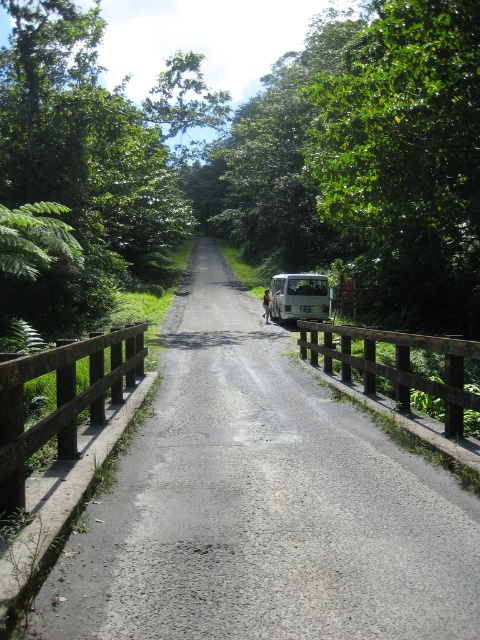
Who is lower down, green leafy tree at upper right or green leafy tree at upper center?

green leafy tree at upper right

Which of these two, green leafy tree at upper right or green leafy tree at upper center, stands taller?

green leafy tree at upper center is taller.

The width and height of the screenshot is (480, 640). Describe the element at coordinates (407, 157) in the screenshot. I see `green leafy tree at upper right` at that location.

The height and width of the screenshot is (640, 480). Identify the location of green leafy tree at upper right. (407, 157).

Which is above, green leafy tree at center or white matte van at center?

green leafy tree at center is higher up.

Measure the distance between green leafy tree at center and camera.

green leafy tree at center is 50.81 feet away from camera.

Is point (62, 189) closer to camera compared to point (277, 301)?

Yes.

Where is `green leafy tree at center`? green leafy tree at center is located at coordinates (88, 157).

Is the position of green leafy tree at upper right less distant than that of green leafy tree at center?

Yes, green leafy tree at upper right is closer to the viewer.

Between point (396, 150) and point (56, 64), which one is positioned in front?

Point (396, 150)

The image size is (480, 640). In order to click on green leafy tree at upper right in this screenshot , I will do tap(407, 157).